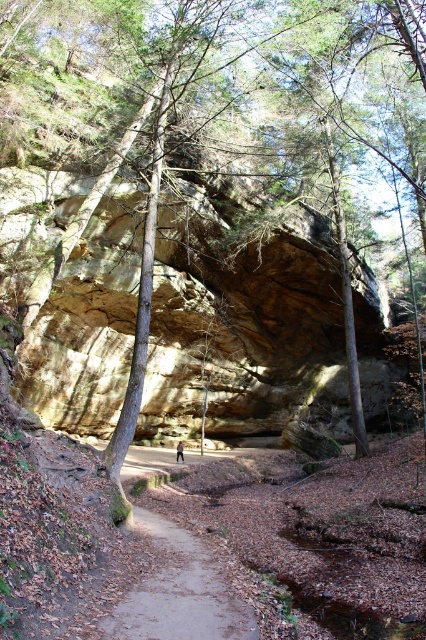
Which is behind, point (255, 630) or point (176, 454)?

Positioned behind is point (176, 454).

Who is higher up, brown dirt path at center or blue fabric person at center?

brown dirt path at center is higher up.

Is point (161, 536) positioned before point (183, 444)?

Yes, it is.

Where is `brown dirt path at center`? The height and width of the screenshot is (640, 426). brown dirt path at center is located at coordinates (178, 592).